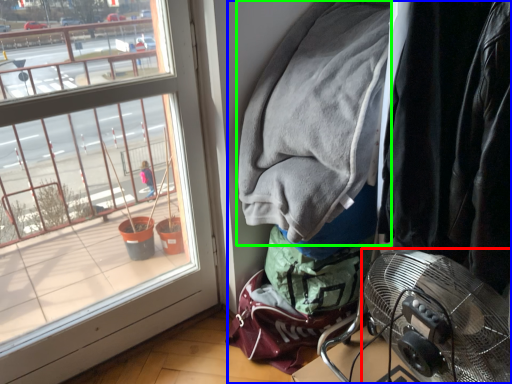
Question: Based on their relative distances, which object is nearer to mechanical fan (highlighted by a red box)? Choose from closet (highlighted by a blue box) and jacket (highlighted by a green box).

Choices:
 (A) closet
 (B) jacket

Answer: (A)